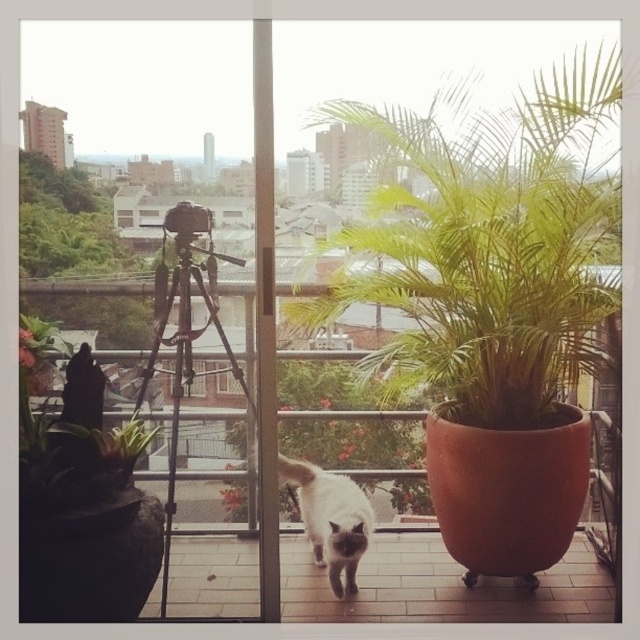
Question: Which object appears closest to the camera in this image?

Choices:
 (A) green leafy plant at upper right
 (B) white fur cat at center

Answer: (A)

Question: Which object is positioned closest to the green leafy plant at upper right?

Choices:
 (A) white fur cat at center
 (B) green leafy plant at center
 (C) green matte plant at left
 (D) transparent glass window at center

Answer: (B)

Question: Based on their relative distances, which object is nearer to the green leafy plant at center?

Choices:
 (A) green leafy plant at upper right
 (B) green matte plant at left

Answer: (A)

Question: Can you confirm if green leafy plant at center is positioned to the left of transparent glass window at center?

Choices:
 (A) yes
 (B) no

Answer: (B)

Question: Does green matte plant at left have a lesser width compared to transparent glass window at center?

Choices:
 (A) yes
 (B) no

Answer: (B)

Question: In this image, where is green leafy plant at upper right located relative to white fur cat at center?

Choices:
 (A) above
 (B) below

Answer: (A)